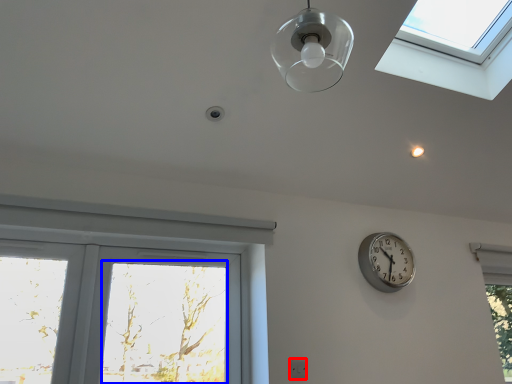
Question: Which point is further to the camera, electric outlet (highlighted by a red box) or window screen (highlighted by a blue box)?

Choices:
 (A) electric outlet
 (B) window screen

Answer: (A)